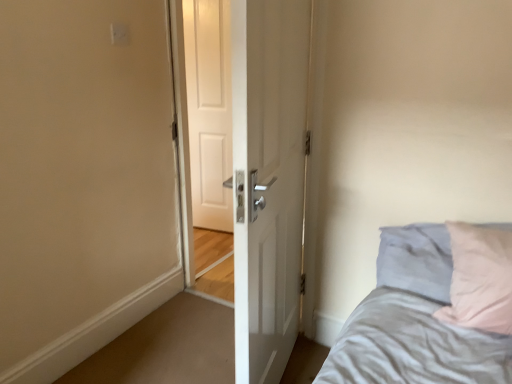
Question: Is white glossy door at center to the left of white matte door at center from the viewer's perspective?

Choices:
 (A) yes
 (B) no

Answer: (B)

Question: Considering the relative sizes of white glossy door at center and white matte door at center in the image provided, is white glossy door at center thinner than white matte door at center?

Choices:
 (A) no
 (B) yes

Answer: (A)

Question: Is white glossy door at center further to the viewer compared to white matte door at center?

Choices:
 (A) no
 (B) yes

Answer: (A)

Question: Does white glossy door at center have a larger size compared to white matte door at center?

Choices:
 (A) yes
 (B) no

Answer: (A)

Question: Does white glossy door at center have a greater width compared to white matte door at center?

Choices:
 (A) no
 (B) yes

Answer: (B)

Question: Is white matte door at center at the back of white glossy door at center?

Choices:
 (A) yes
 (B) no

Answer: (B)

Question: From the image's perspective, would you say white glossy door at center is positioned over white plastic electric outlet at upper center?

Choices:
 (A) no
 (B) yes

Answer: (A)

Question: Is white glossy door at center positioned beyond the bounds of white plastic electric outlet at upper center?

Choices:
 (A) yes
 (B) no

Answer: (A)

Question: Considering the relative sizes of white glossy door at center and white plastic electric outlet at upper center in the image provided, is white glossy door at center bigger than white plastic electric outlet at upper center?

Choices:
 (A) no
 (B) yes

Answer: (B)

Question: Does white glossy door at center have a lesser height compared to white plastic electric outlet at upper center?

Choices:
 (A) yes
 (B) no

Answer: (B)

Question: Is white glossy door at center wider than white plastic electric outlet at upper center?

Choices:
 (A) yes
 (B) no

Answer: (A)

Question: Can you confirm if white glossy door at center is thinner than white plastic electric outlet at upper center?

Choices:
 (A) yes
 (B) no

Answer: (B)

Question: From a real-world perspective, is white matte door at center under white plastic electric outlet at upper center?

Choices:
 (A) no
 (B) yes

Answer: (B)